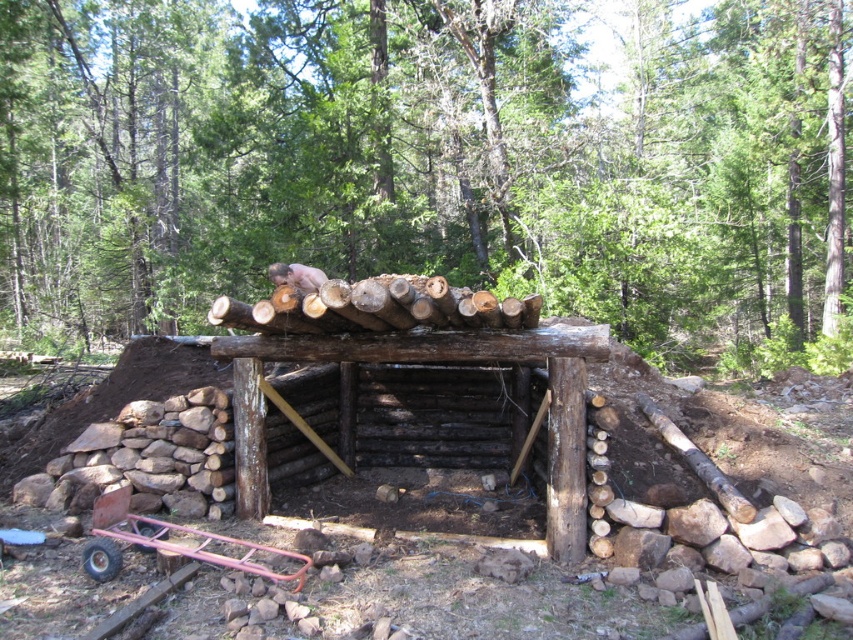
Question: Is brown rough wood at upper center behind metallic pink cart at lower left?

Choices:
 (A) yes
 (B) no

Answer: (A)

Question: Is brown rough wood at upper center bigger than natural wood log shelter at center?

Choices:
 (A) no
 (B) yes

Answer: (B)

Question: Which object appears closest to the camera in this image?

Choices:
 (A) natural wood log shelter at center
 (B) brown rough wood at upper center
 (C) metallic pink cart at lower left

Answer: (C)

Question: Is brown rough wood at upper center above natural wood log shelter at center?

Choices:
 (A) yes
 (B) no

Answer: (A)

Question: Which point appears closest to the camera in this image?

Choices:
 (A) (196, 22)
 (B) (567, 355)

Answer: (B)

Question: Which object is positioned closest to the brown rough wood at upper center?

Choices:
 (A) natural wood log shelter at center
 (B) metallic pink cart at lower left

Answer: (B)